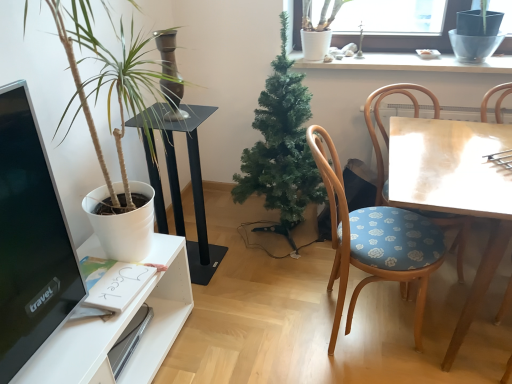
Find the location of a particular element. This screenshot has height=384, width=512. vacant space to the right of black glass table at center is located at coordinates (240, 265).